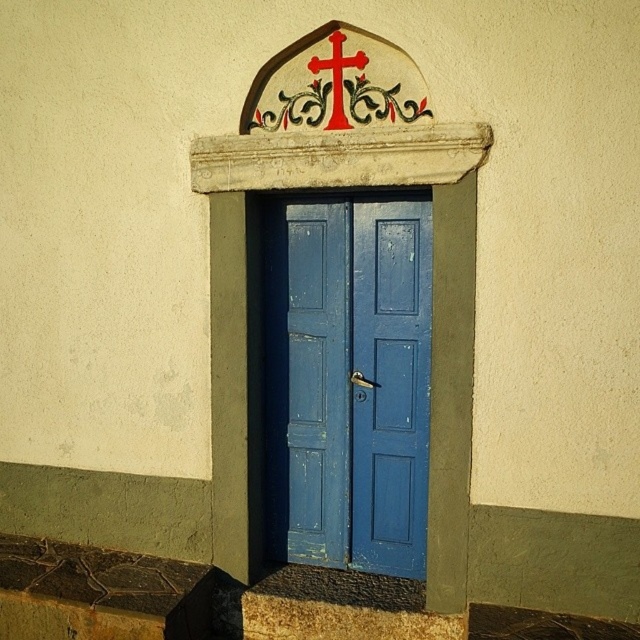
Between blue wooden door at center and red painted wood cross at upper center, which one appears on the left side from the viewer's perspective?

red painted wood cross at upper center is more to the left.

Based on the photo, can you confirm if blue wooden door at center is shorter than red painted wood cross at upper center?

In fact, blue wooden door at center may be taller than red painted wood cross at upper center.

The width and height of the screenshot is (640, 640). Find the location of `blue wooden door at center`. blue wooden door at center is located at coordinates (348, 381).

This screenshot has width=640, height=640. What are the coordinates of `blue wooden door at center` in the screenshot? It's located at (348, 381).